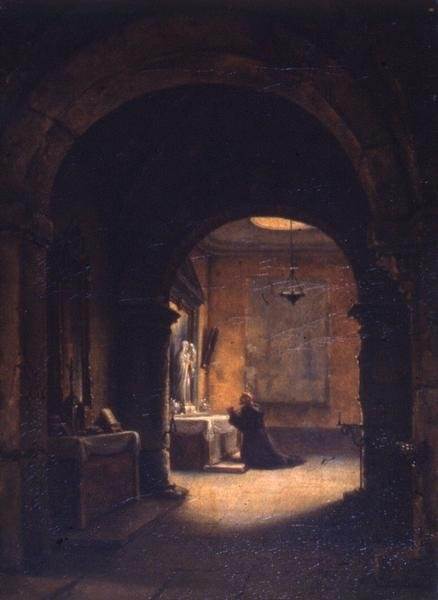
Image resolution: width=438 pixels, height=600 pixels. What are the coordinates of `painting` in the screenshot? It's located at (296, 342).